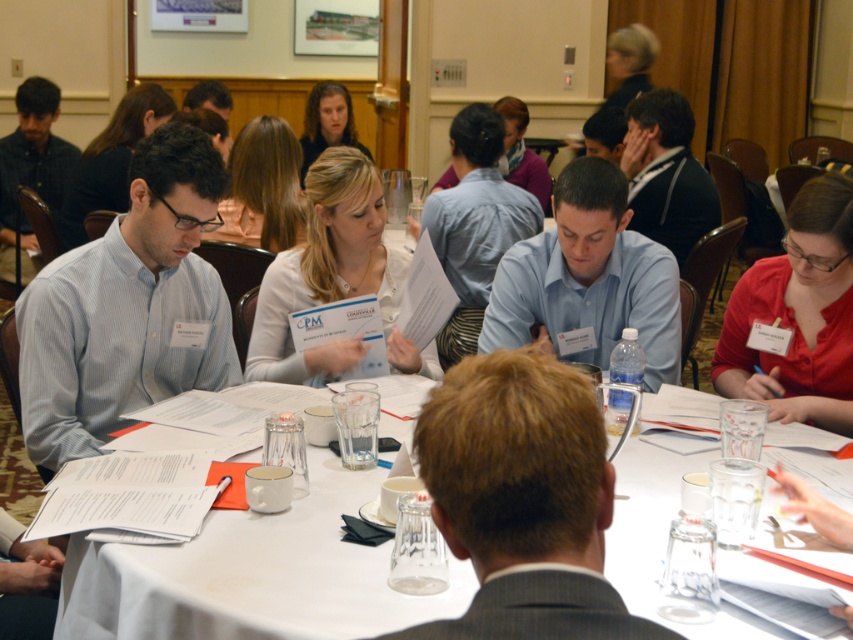
Question: Is light blue striped shirt at left further to camera compared to matte black shirt at left?

Choices:
 (A) yes
 (B) no

Answer: (B)

Question: Does light blue striped shirt at left come in front of matte black shirt at left?

Choices:
 (A) no
 (B) yes

Answer: (B)

Question: Which of these objects is positioned closest to the light blue striped shirt at left?

Choices:
 (A) brown hair at center
 (B) matte black shirt at left

Answer: (A)

Question: Considering the relative positions of white paper at center and matte black shirt at left in the image provided, where is white paper at center located with respect to matte black shirt at left?

Choices:
 (A) below
 (B) above

Answer: (A)

Question: Among these points, which one is nearest to the camera?

Choices:
 (A) (502, 257)
 (B) (25, 173)

Answer: (A)

Question: Which object appears farthest from the camera in this image?

Choices:
 (A) light blue striped shirt at left
 (B) matte black shirt at left

Answer: (B)